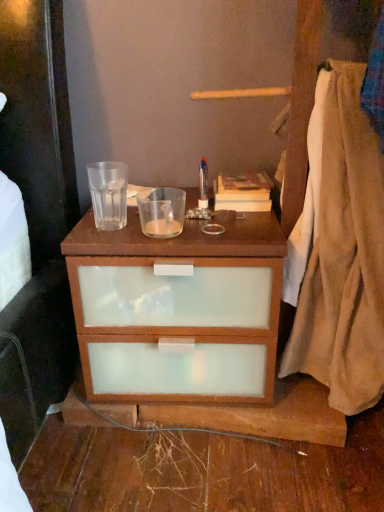
Question: From a real-world perspective, is hardcover book at upper right positioned above or below beige cotton blanket at right?

Choices:
 (A) below
 (B) above

Answer: (A)

Question: In the image, is hardcover book at upper right positioned in front of or behind beige cotton blanket at right?

Choices:
 (A) front
 (B) behind

Answer: (B)

Question: Considering the positions of hardcover book at upper right and beige cotton blanket at right in the image, is hardcover book at upper right wider or thinner than beige cotton blanket at right?

Choices:
 (A) thin
 (B) wide

Answer: (A)

Question: Relative to hardcover book at upper right, is beige cotton blanket at right in front or behind?

Choices:
 (A) front
 (B) behind

Answer: (A)

Question: From the image's perspective, is beige cotton blanket at right positioned above or below hardcover book at upper right?

Choices:
 (A) below
 (B) above

Answer: (A)

Question: In terms of size, does beige cotton blanket at right appear bigger or smaller than hardcover book at upper right?

Choices:
 (A) small
 (B) big

Answer: (B)

Question: Would you say beige cotton blanket at right is inside or outside hardcover book at upper right?

Choices:
 (A) outside
 (B) inside

Answer: (A)